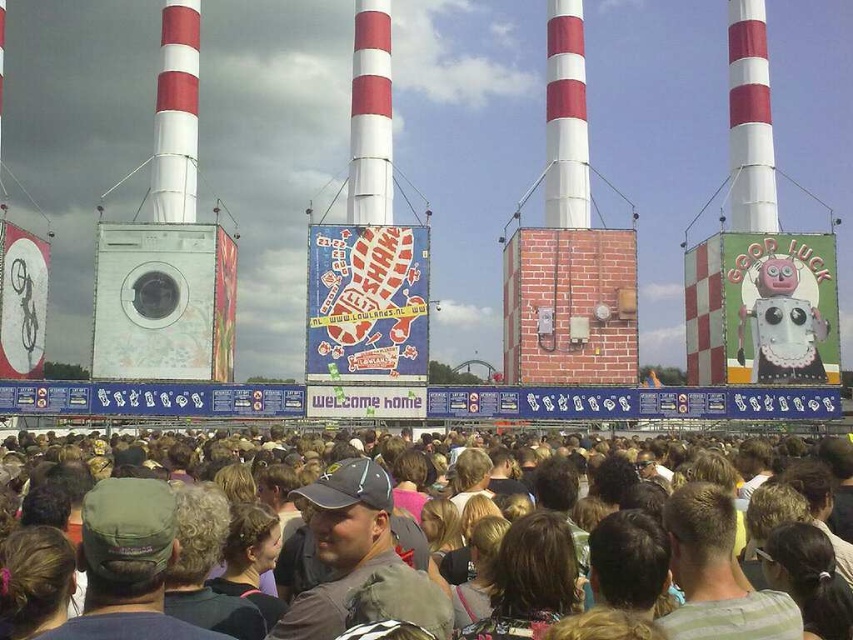
You are at the music festival and need to find the white striped rocket at upper right. Based on the scene description, where should you look relative to the industrial chimneys?

The white striped rocket at upper right is located at point (749, 120) relative to the industrial chimneys, so you should look towards the upper right direction from the chimneys to find it.

You are standing at the position of the camera and want to reach both the point at coordinates (566, 124) and the point at coordinates (389, 35). Which point will you reach first if you move straight towards them?

You will reach point (566, 124) first because it is closer to the camera than point (389, 35).